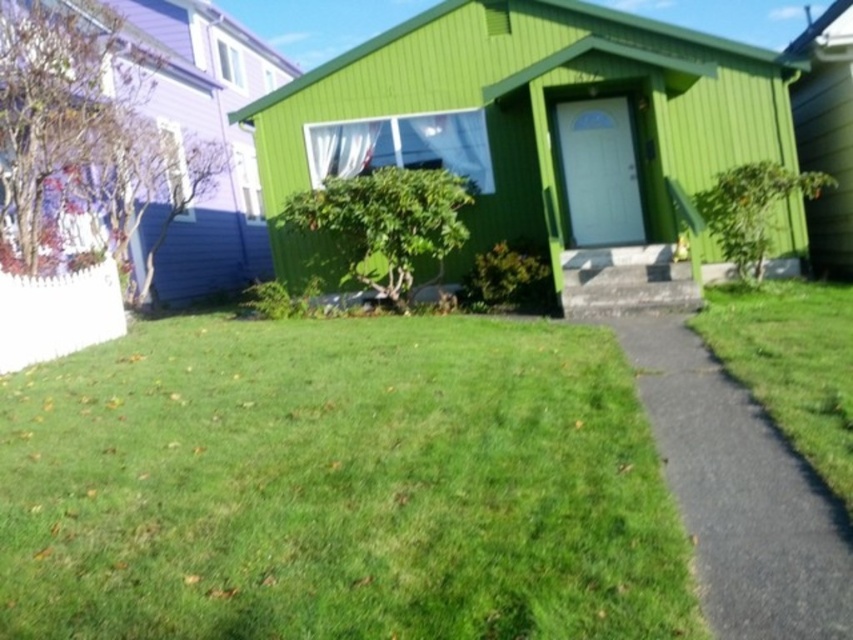
Question: Does black asphalt driveway at lower right have a greater width compared to green grass at lower right?

Choices:
 (A) no
 (B) yes

Answer: (A)

Question: Can you confirm if green grass at center is thinner than black asphalt driveway at lower right?

Choices:
 (A) no
 (B) yes

Answer: (A)

Question: Can you confirm if green grass at center is wider than green grass at lower right?

Choices:
 (A) no
 (B) yes

Answer: (B)

Question: Which point is closer to the camera?

Choices:
 (A) (717, 364)
 (B) (720, 285)

Answer: (A)

Question: Based on their relative distances, which object is farther from the green grass at lower right?

Choices:
 (A) green grass at center
 (B) black asphalt driveway at lower right

Answer: (A)

Question: Based on their relative distances, which object is farther from the green grass at center?

Choices:
 (A) green grass at lower right
 (B) black asphalt driveway at lower right

Answer: (A)